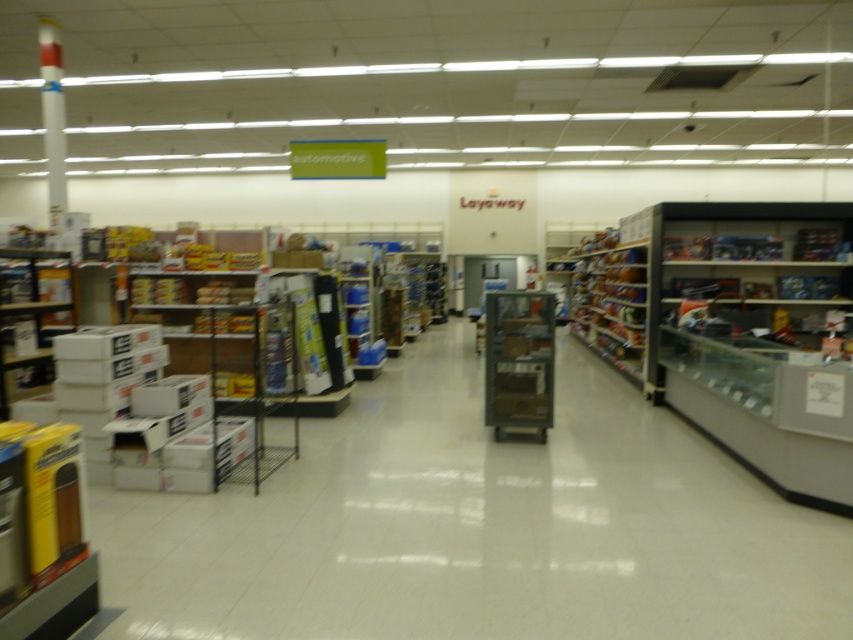
Question: Is metallic silver shelf at center bigger than metallic silver shelves at center-right?

Choices:
 (A) no
 (B) yes

Answer: (A)

Question: Can you confirm if metallic silver shelf at center is positioned above metallic silver shelves at center-right?

Choices:
 (A) yes
 (B) no

Answer: (B)

Question: Which of the following is the farthest from the observer?

Choices:
 (A) metallic silver shelf at center
 (B) metallic silver shelves at center-right

Answer: (B)

Question: Which object is farther from the camera taking this photo?

Choices:
 (A) metallic silver shelves at center-right
 (B) metallic silver shelf at center

Answer: (A)

Question: Which of the following is the closest to the observer?

Choices:
 (A) (494, 353)
 (B) (570, 256)

Answer: (A)

Question: Observing the image, what is the correct spatial positioning of metallic silver shelf at center in reference to metallic silver shelves at center-right?

Choices:
 (A) below
 (B) above

Answer: (A)